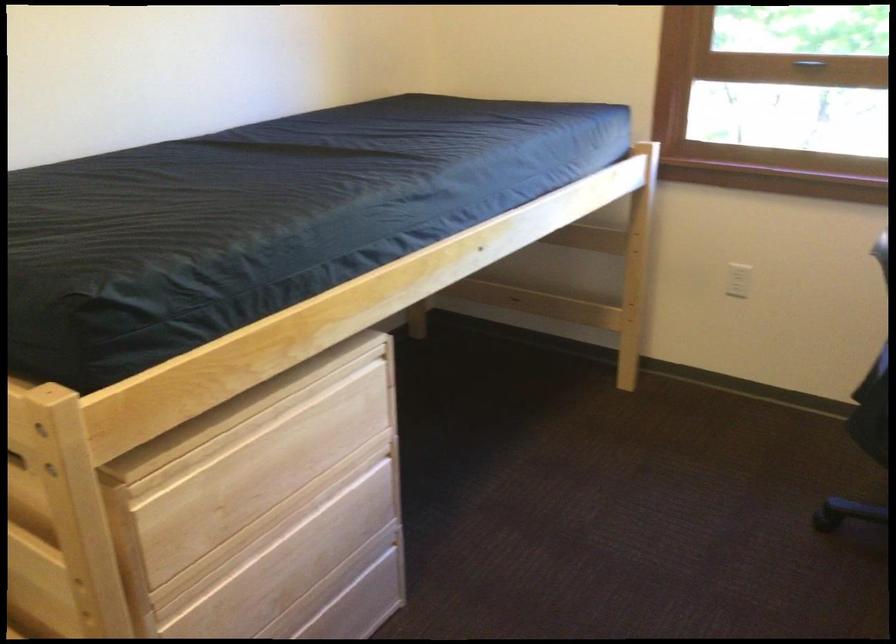
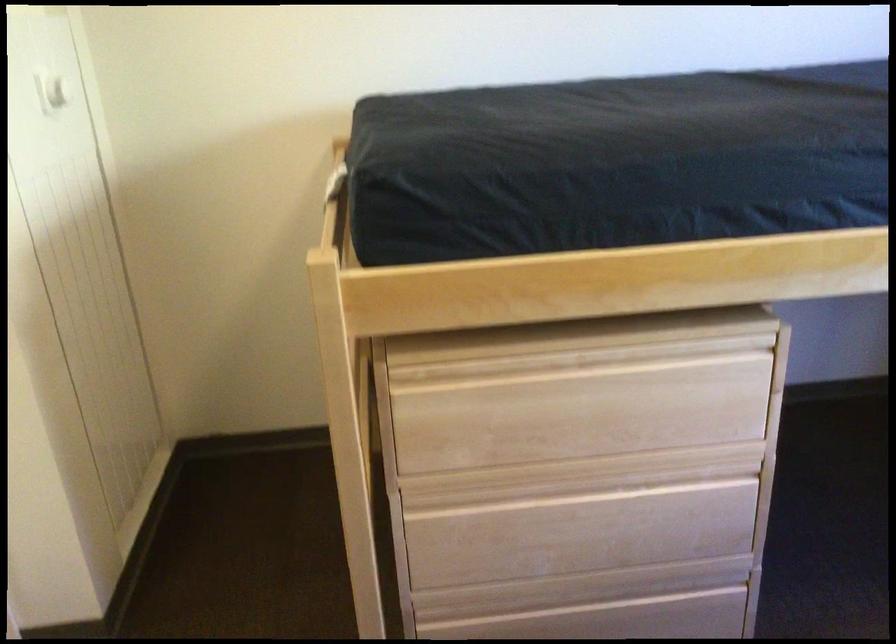
The point at (262, 547) is marked in the first image. Where is the corresponding point in the second image?

(546, 491)